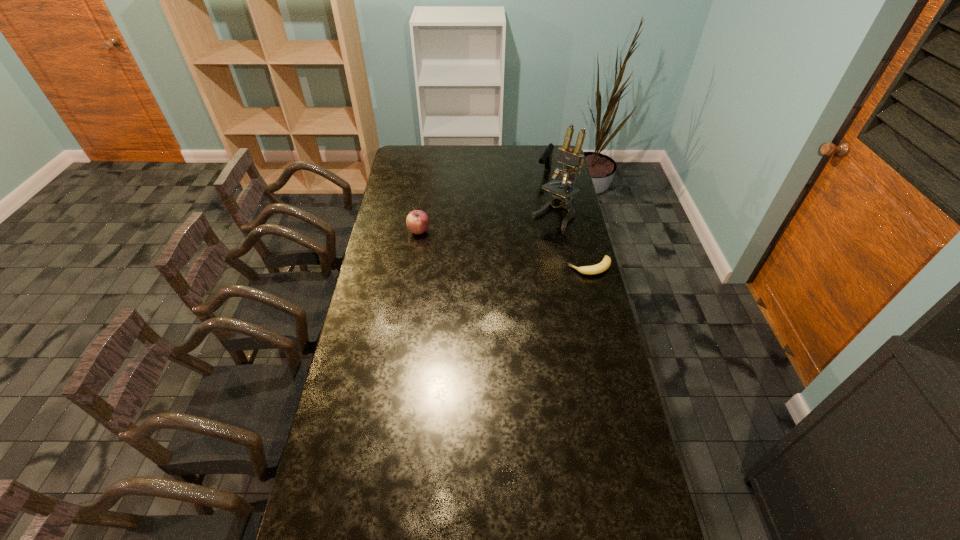
You are a GUI agent. You are given a task and a screenshot of the screen. Output one action in this format:
    pyautogui.click(x=<x>, y=<y>)
    Task: Click on the vacant area that satisfies the following two spatial constraints: 1. on the front side of the second shortest object; 2. on the left side of the nearest object
    
    Given the screenshot: What is the action you would take?
    pyautogui.click(x=414, y=267)